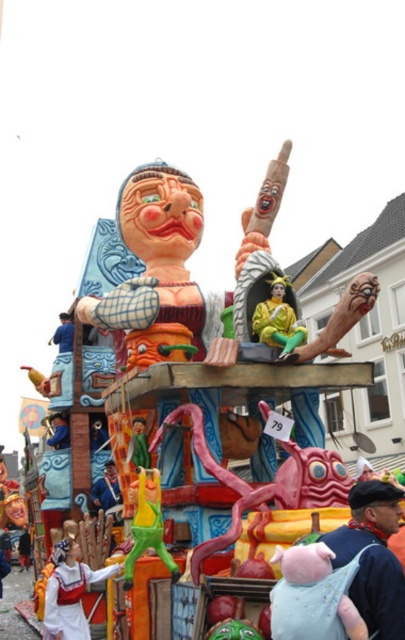
You are a photographer trying to capture both the white fabric figure at lower left and the shiny gold costume at center in a single shot. Which object should you focus on first to ensure both are in frame?

You should focus on the white fabric figure at lower left first since it is larger in size than the shiny gold costume at center, making it easier to frame both in the shot.

You are a photographer at the carnival parade. You need to capture a photo that includes both the white fabric figure at lower left and the matte blue helmet at upper left. Which object should you place closer to the bottom of the frame to ensure both are visible?

To ensure both the white fabric figure at lower left and the matte blue helmet at upper left are visible in the photo, you should place the white fabric figure at lower left closer to the bottom of the frame since it is positioned under the matte blue helmet at upper left.